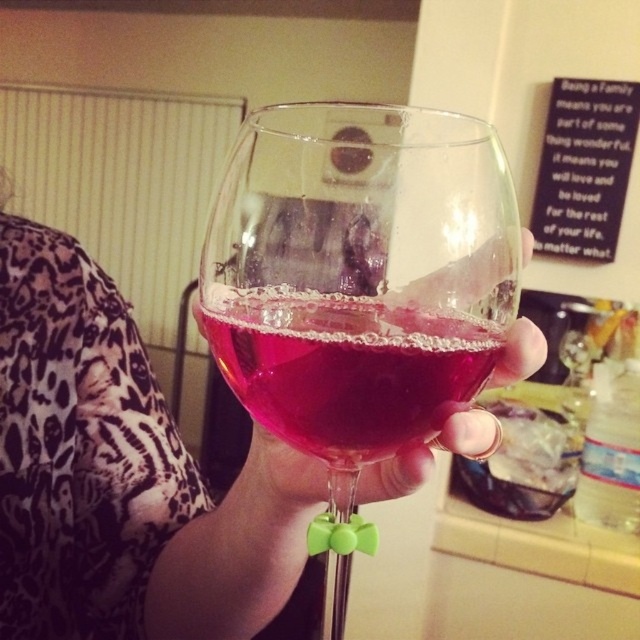
You are a bartender preparing a drink. You have a transparent glass at center and a translucent glass wine at center. Which object should you place the wine into, and why?

You should place the wine into the transparent glass at center because the translucent glass wine at center is already filled with wine, as indicated by its description as being positioned under the transparent glass.

You are taking a photo of the wine glass and notice two points on it. The first point is at coordinates point (417, 296) and the second is at point (403, 412). Which point is closer to the camera?

Point (417, 296) is closer to the camera than point (403, 412).

Looking at this image, you are a bartender trying to clean the transparent glass at center and the translucent glass wine at center. Which object should you clean first if you want to start with the one closer to you?

The transparent glass at center is closer to you than the translucent glass wine at center, so you should clean the transparent glass at center first.